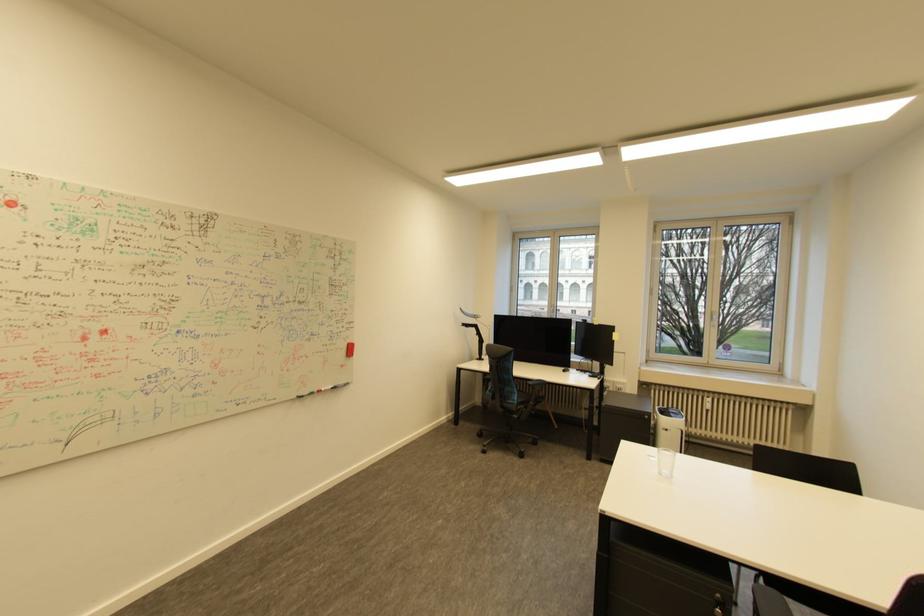
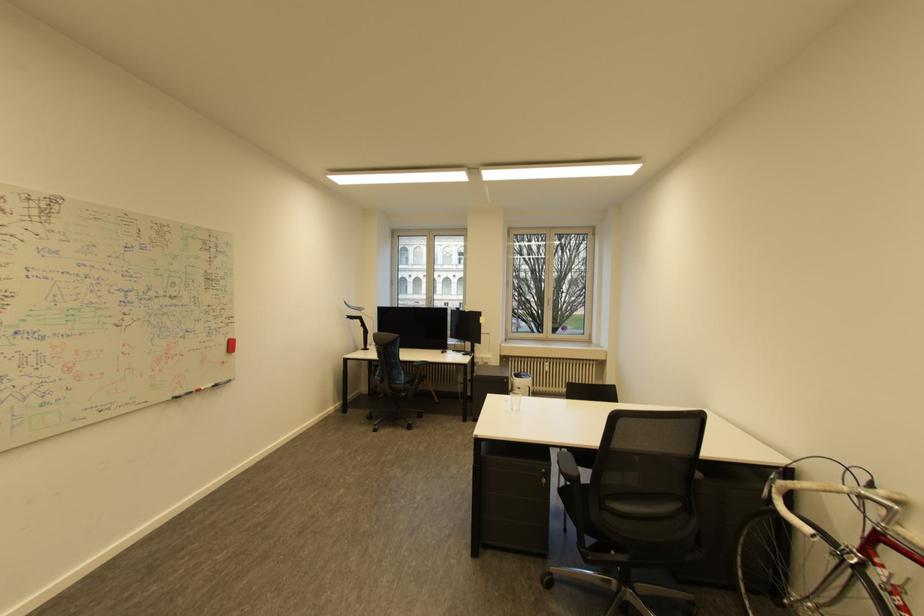
Find the pixel in the second image that matches (x=301, y=398) in the first image.

(176, 399)